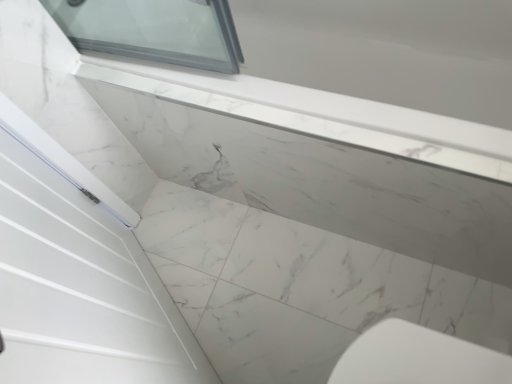
Locate an element on the screen. vacant region under white marble window sill at upper center (from a real-world perspective) is located at coordinates (330, 234).